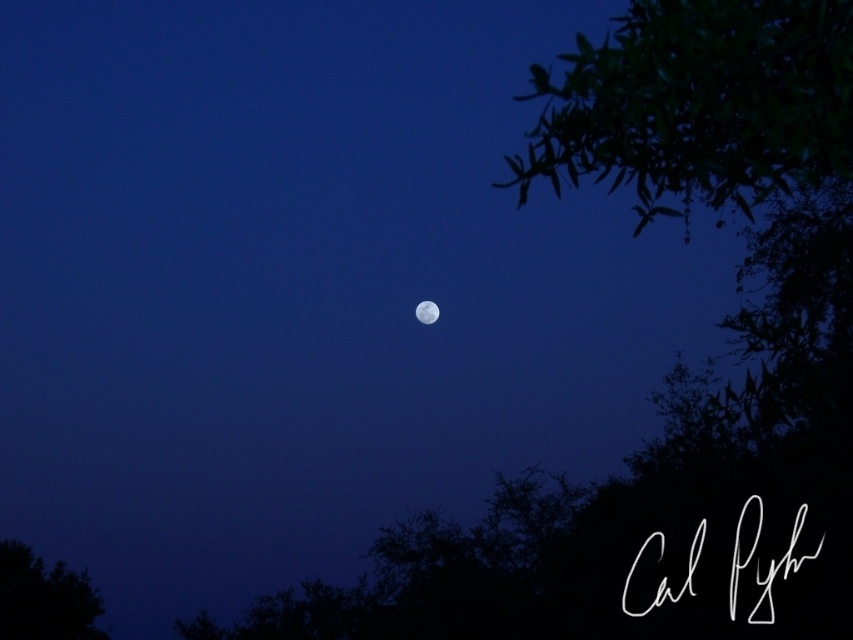
You are an astronomer observing the night sky. You notice the green leafy branches at upper right and the white reflective moon at center. Which object appears larger in the image?

The green leafy branches at upper right is bigger than the white reflective moon at center, so the green leafy branches at upper right appears larger in the image.